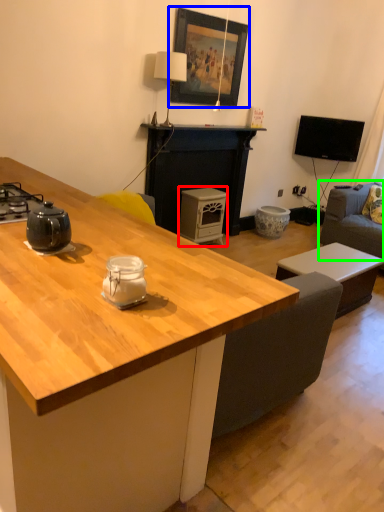
Question: Which object is the farthest from appliance (highlighted by a red box)? Choose among these: picture frame (highlighted by a blue box) or studio couch (highlighted by a green box).

Choices:
 (A) picture frame
 (B) studio couch

Answer: (B)